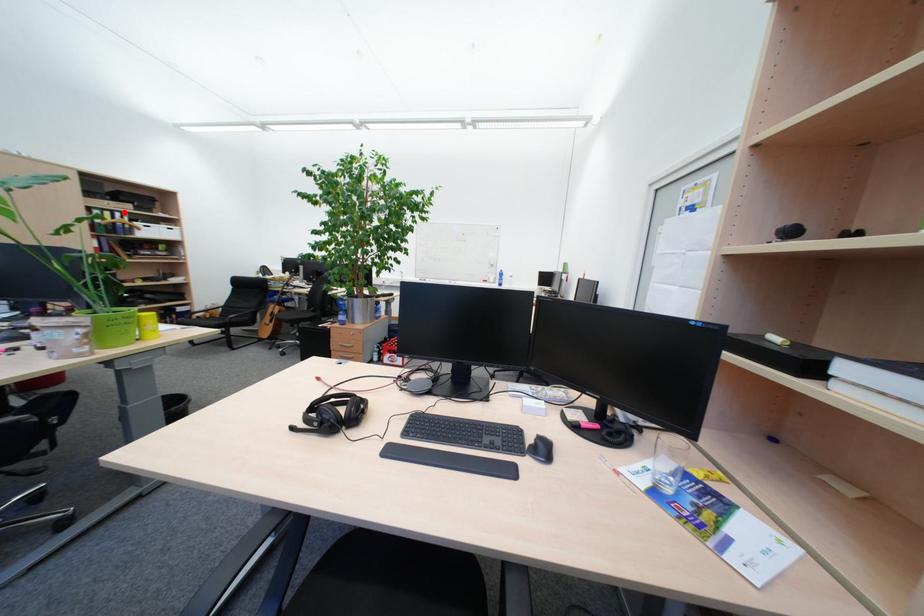
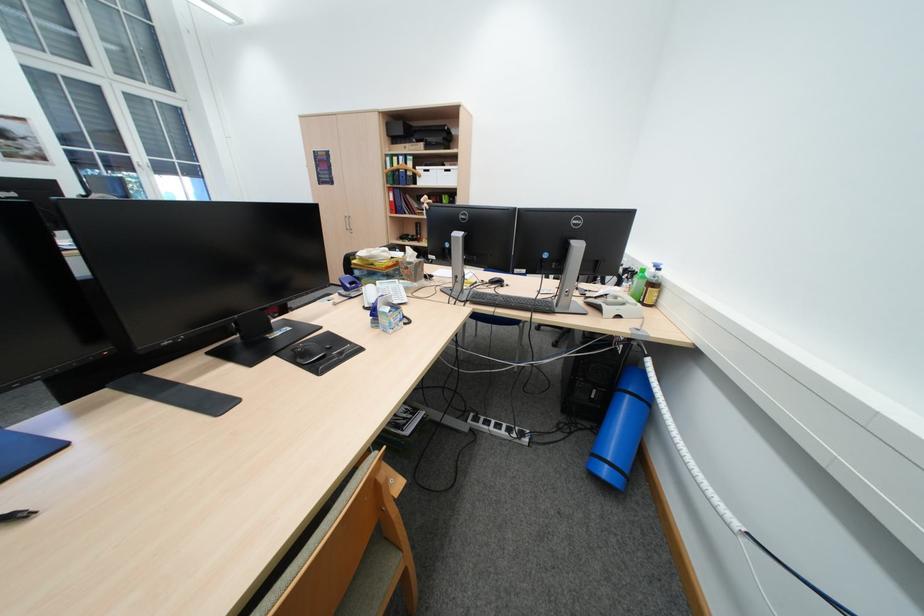
Question: I am providing you with two images of the same scene from different viewpoints. A red point is shown in image1. For the corresponding object point in image2, is it positioned nearer or farther from the camera?

Choices:
 (A) Nearer
 (B) Farther

Answer: (A)